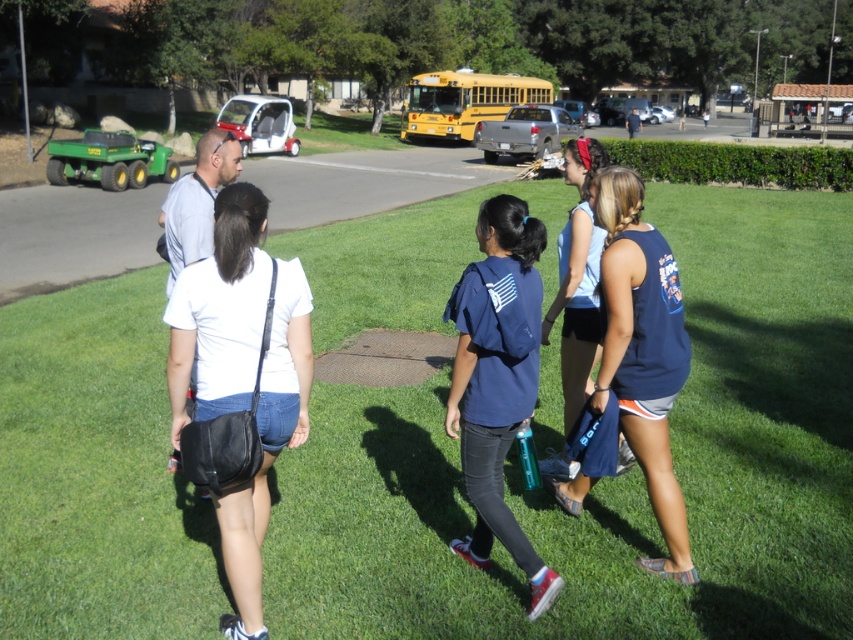
You are standing at the point marked as point (x=611, y=477). What is the terrain type under your feet?

The terrain type under your feet at point (x=611, y=477) is green grass at center.

You are standing at the origin point of the image. Which direction should you walk to reach the green grass at center?

The green grass at center is located at point (611, 477), so you should walk towards the center of the image to reach it.